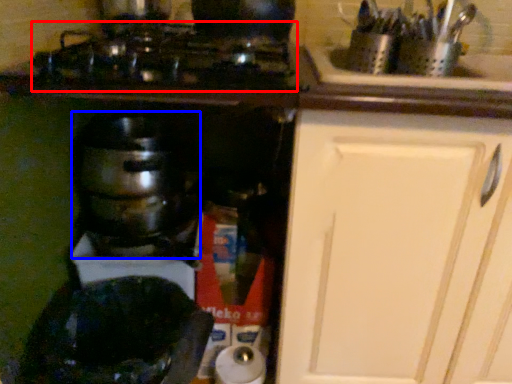
Question: Which point is further to the camera, gas stove (highlighted by a red box) or kitchen appliance (highlighted by a blue box)?

Choices:
 (A) gas stove
 (B) kitchen appliance

Answer: (B)